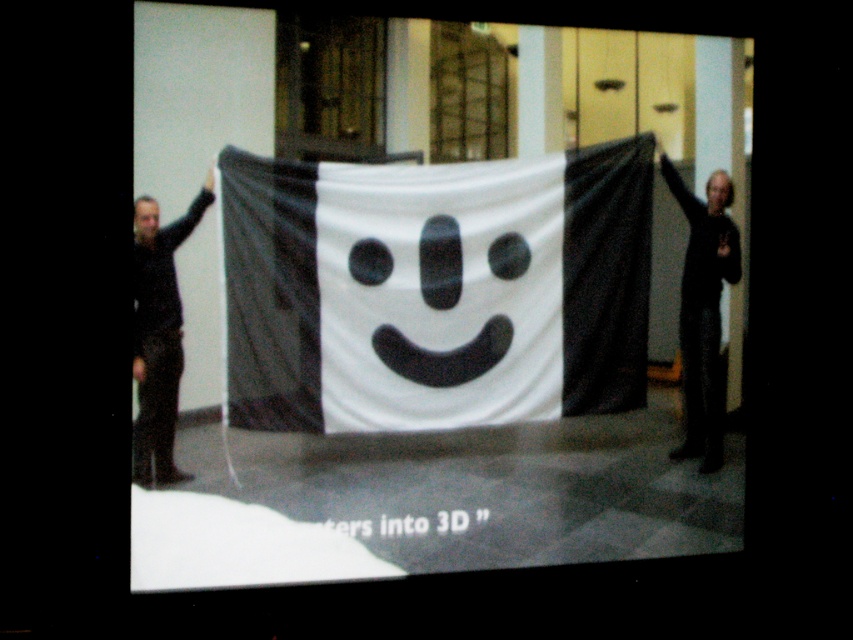
Question: Can you confirm if white fabric banner at center is positioned to the right of smooth skin face at left?

Choices:
 (A) no
 (B) yes

Answer: (B)

Question: Can you confirm if smooth skin face at left is thinner than smooth skin face at upper right?

Choices:
 (A) yes
 (B) no

Answer: (A)

Question: Which is farther from the black matte clothing at left?

Choices:
 (A) smooth skin face at left
 (B) black matte sweater at right

Answer: (B)

Question: Which of the following is the closest to the observer?

Choices:
 (A) (711, 198)
 (B) (142, 225)
 (C) (189, 227)
 (D) (473, 294)

Answer: (B)

Question: Which point appears closest to the camera in this image?

Choices:
 (A) (x=291, y=257)
 (B) (x=729, y=196)
 (C) (x=698, y=451)

Answer: (A)

Question: Can you confirm if black matte sweater at right is positioned above black matte clothing at left?

Choices:
 (A) no
 (B) yes

Answer: (B)